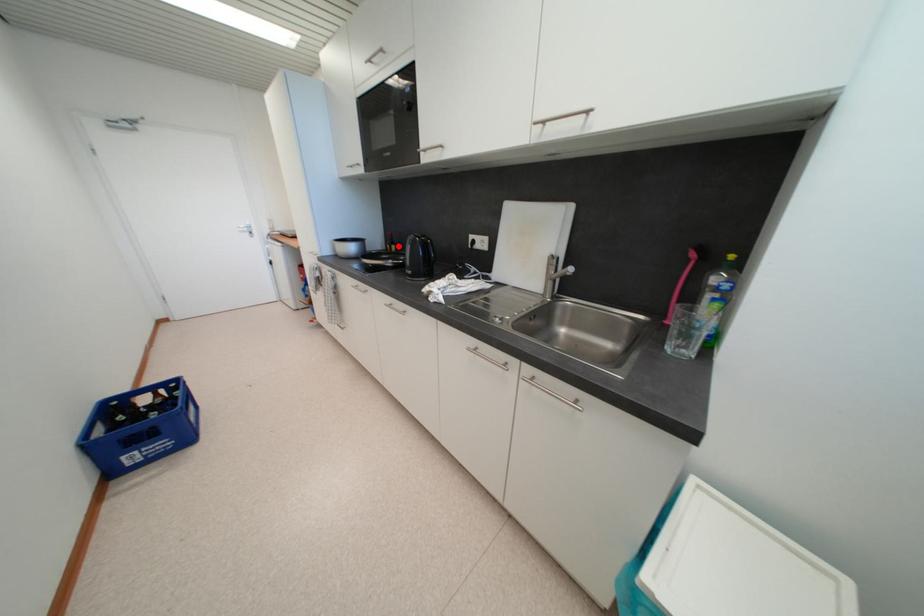
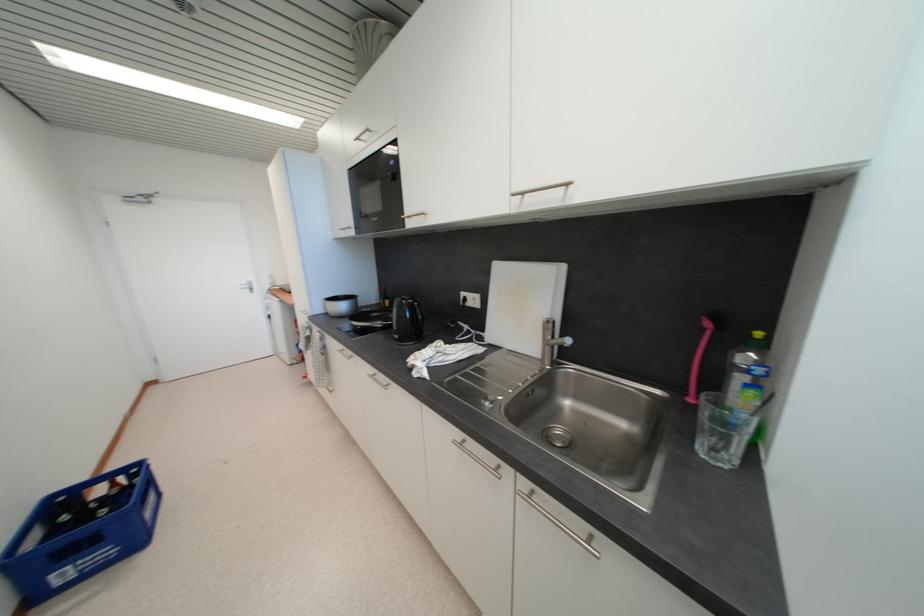
Question: I am providing you with two images of the same scene from different viewpoints. Image1 has a red point marked. In image2, the corresponding 3D location appears at what relative position? Reply with the corresponding letter.

Choices:
 (A) Closer
 (B) Farther

Answer: (B)